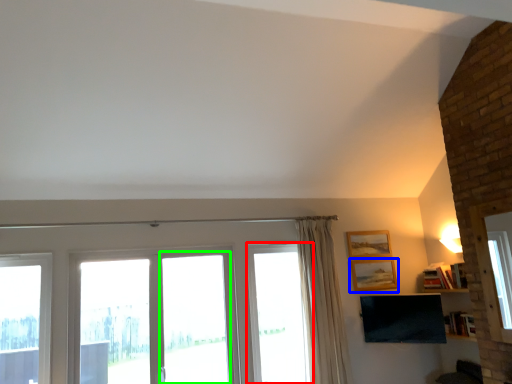
Question: Which is farther away from window (highlighted by a red box)? picture frame (highlighted by a blue box) or screen door (highlighted by a green box)?

Choices:
 (A) picture frame
 (B) screen door

Answer: (A)